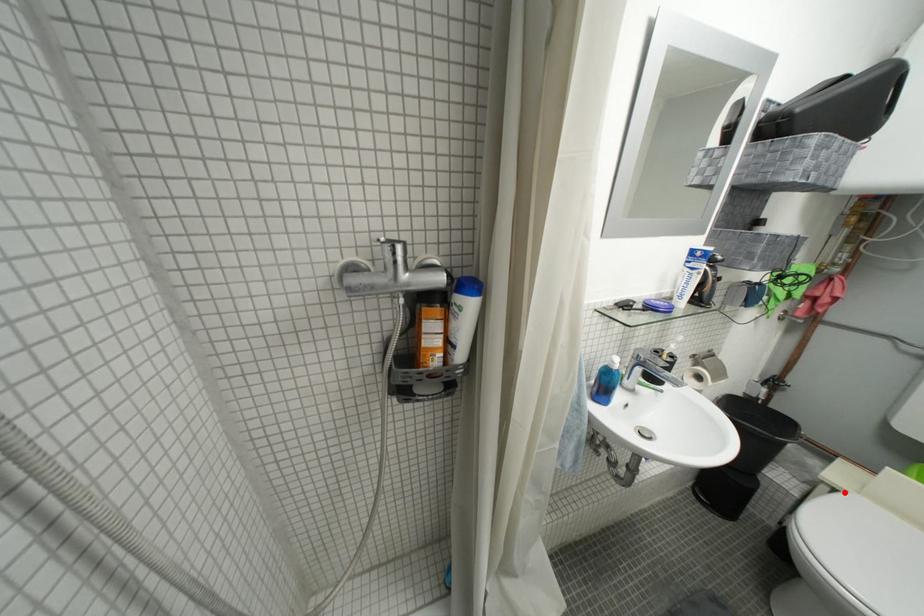
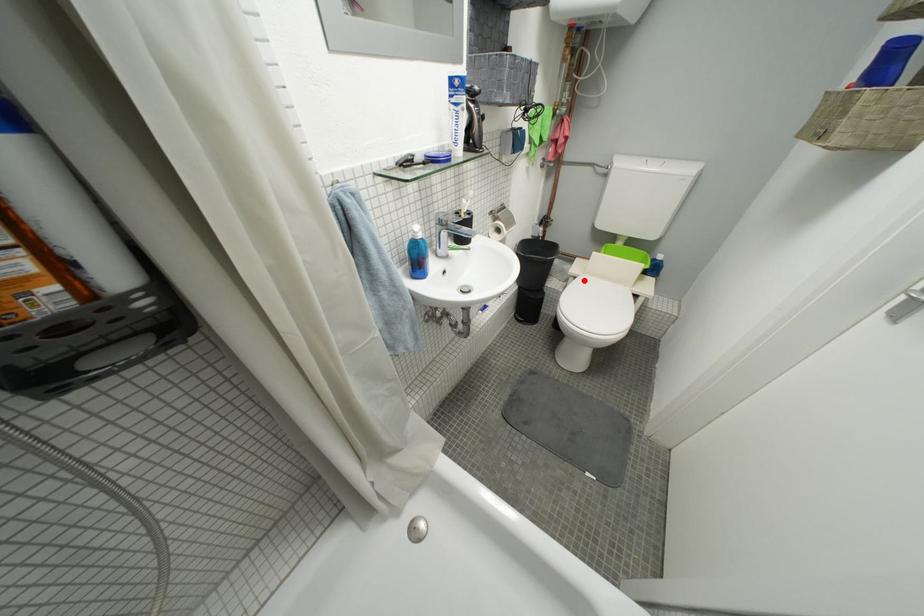
I am providing you with two images of the same scene from different viewpoints. A red point is marked on the first image and another point is marked on the second image. Is the marked point in image1 the same physical position as the marked point in image2?

Yes